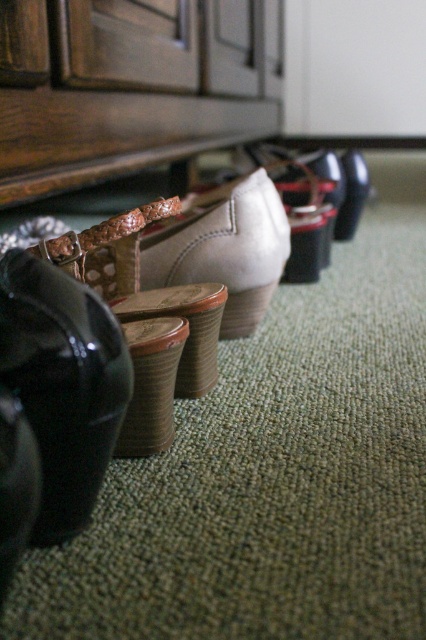
Question: Does shiny black shoe at lower left appear under leather/textured shoe at center?

Choices:
 (A) yes
 (B) no

Answer: (A)

Question: Among these points, which one is farthest from the camera?

Choices:
 (A) (187, 216)
 (B) (43, 305)

Answer: (A)

Question: Is shiny black shoe at lower left wider than leather/textured shoe at center?

Choices:
 (A) no
 (B) yes

Answer: (A)

Question: Which point is closer to the camera?

Choices:
 (A) (121, 362)
 (B) (281, 256)

Answer: (A)

Question: Is shiny black shoe at lower left above leather/textured shoe at center?

Choices:
 (A) no
 (B) yes

Answer: (A)